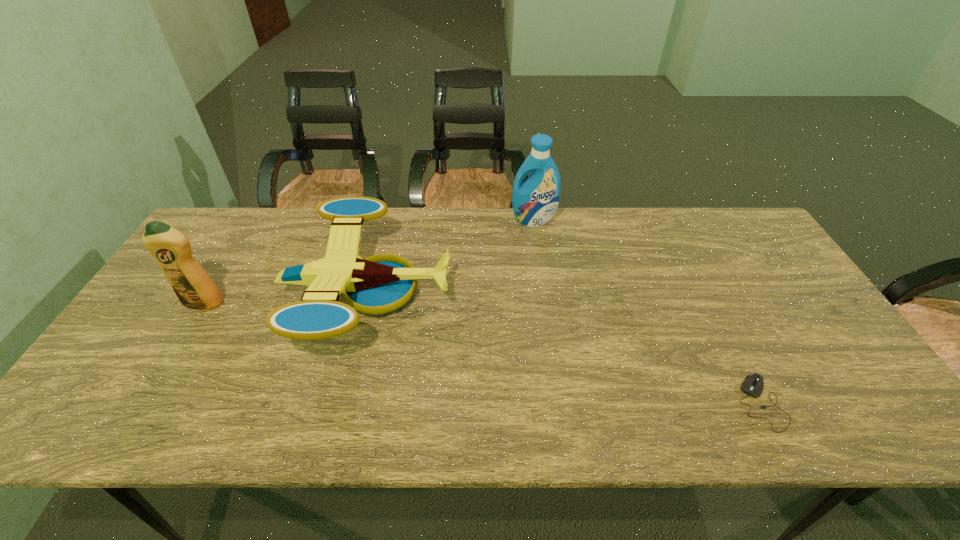
You are a GUI agent. You are given a task and a screenshot of the screen. Output one action in this format:
    pyautogui.click(x=<x>, y=<y>)
    Task: Click on the vacant area situated 0.280m at the cockpit of the third object from right to left
    
    Given the screenshot: What is the action you would take?
    pyautogui.click(x=551, y=294)

At what (x,y) coordinates should I click in order to perform the action: click on vacant space positioned 0.210m on the left of the nearest object. Please return your answer as a coordinate pair (x, y). This screenshot has width=960, height=540. Looking at the image, I should click on (647, 402).

Where is `detergent present at the far edge`? detergent present at the far edge is located at coordinates (535, 201).

The height and width of the screenshot is (540, 960). Identify the location of drone at the far edge. [x=379, y=284].

Find the location of a particular element. This screenshot has width=960, height=540. object at the near edge is located at coordinates (753, 384).

The image size is (960, 540). I want to click on object that is positioned at the left edge, so click(192, 285).

Identify the location of vacant position at the far edge of the desktop. Image resolution: width=960 pixels, height=540 pixels. (468, 220).

Where is `vacant space at the near edge of the desktop`? vacant space at the near edge of the desktop is located at coordinates (660, 420).

You are a GUI agent. You are given a task and a screenshot of the screen. Output one action in this format:
    pyautogui.click(x=<x>, y=<y>)
    Task: Click on the vacant point at the left edge
    Image resolution: width=960 pixels, height=540 pixels.
    Given the screenshot: What is the action you would take?
    pyautogui.click(x=109, y=397)

Image resolution: width=960 pixels, height=540 pixels. Find the location of `vacant area at the right edge`. vacant area at the right edge is located at coordinates (778, 330).